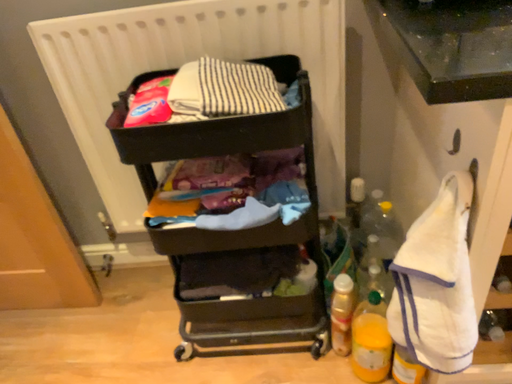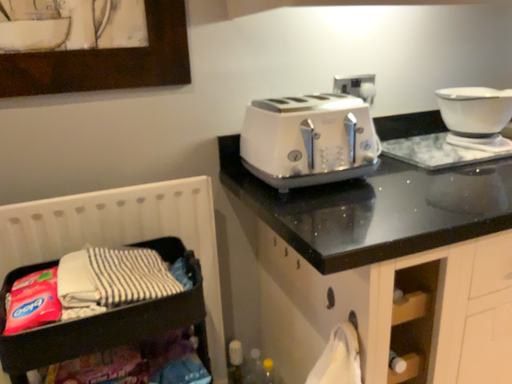
Question: How did the camera likely rotate when shooting the video?

Choices:
 (A) rotated left
 (B) rotated right

Answer: (B)